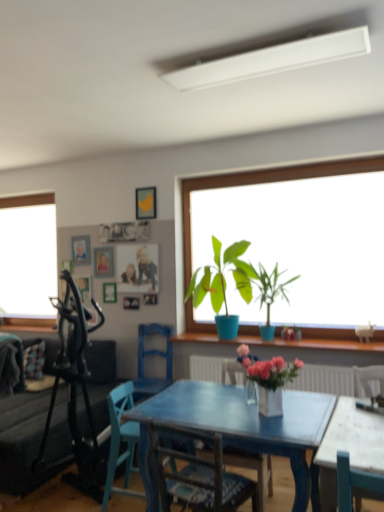
Question: Which direction should I rotate to face wooden chair at center, placed as the 2th chair when sorted from front to back, — up or down?

Choices:
 (A) down
 (B) up

Answer: (A)

Question: Is white matte rectangular light fixture at upper center positioned with its back to wooden picture frame at upper center, the third picture frame in the top-to-bottom sequence?

Choices:
 (A) no
 (B) yes

Answer: (A)

Question: Considering the relative sizes of white matte rectangular light fixture at upper center and wooden picture frame at upper center, the 2th picture frame ordered from the bottom, in the image provided, is white matte rectangular light fixture at upper center smaller than wooden picture frame at upper center, the 2th picture frame ordered from the bottom,?

Choices:
 (A) yes
 (B) no

Answer: (B)

Question: From a real-world perspective, is white matte rectangular light fixture at upper center on wooden picture frame at upper center, the 2th picture frame ordered from the bottom?

Choices:
 (A) yes
 (B) no

Answer: (A)

Question: Considering the relative sizes of white matte rectangular light fixture at upper center and wooden picture frame at upper center, the third picture frame in the top-to-bottom sequence, in the image provided, is white matte rectangular light fixture at upper center thinner than wooden picture frame at upper center, the third picture frame in the top-to-bottom sequence,?

Choices:
 (A) yes
 (B) no

Answer: (B)

Question: Is white matte rectangular light fixture at upper center oriented towards wooden picture frame at upper center, which ranks as the second picture frame in back-to-front order?

Choices:
 (A) yes
 (B) no

Answer: (B)

Question: Can you confirm if white matte rectangular light fixture at upper center is positioned to the right of wooden picture frame at upper center, the 2th picture frame ordered from the bottom?

Choices:
 (A) no
 (B) yes

Answer: (B)

Question: Does white marble table at lower right have a greater width compared to white matte vase at center?

Choices:
 (A) no
 (B) yes

Answer: (B)

Question: From the image's perspective, is white marble table at lower right under white matte vase at center?

Choices:
 (A) yes
 (B) no

Answer: (A)

Question: Could you tell me if white marble table at lower right is facing white matte vase at center?

Choices:
 (A) no
 (B) yes

Answer: (A)

Question: Does white marble table at lower right appear on the left side of white matte vase at center?

Choices:
 (A) no
 (B) yes

Answer: (A)

Question: Is white matte vase at center surrounded by white marble table at lower right?

Choices:
 (A) no
 (B) yes

Answer: (A)

Question: Is white marble table at lower right not close to white matte vase at center?

Choices:
 (A) no
 (B) yes

Answer: (A)

Question: Can you confirm if green matte plant at center, placed as the 1th houseplant when sorted from right to left, is thinner than wooden picture frame at upper center, arranged as the 3th picture frame when viewed from the left?

Choices:
 (A) yes
 (B) no

Answer: (B)